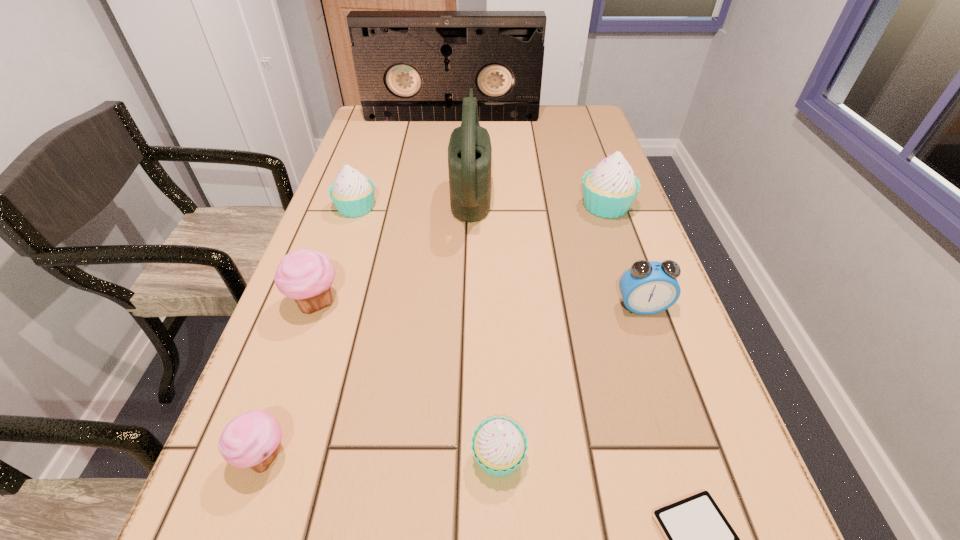
Where is `the second closest cupcake to the third farthest cupcake`? the second closest cupcake to the third farthest cupcake is located at coordinates (251, 440).

Choose which white cupcake is the nearest neighbor to the smallest white cupcake. Please provide its 2D coordinates. Your answer should be formatted as a tuple, i.e. [(x, y)], where the tuple contains the x and y coordinates of a point satisfying the conditions above.

[(609, 189)]

This screenshot has width=960, height=540. In order to click on white cupcake that stands as the second closest to the second white cupcake from right to left in this screenshot , I will do `click(352, 193)`.

Where is `vacant region that satisfies the following two spatial constraints: 1. on the front side of the smallest white cupcake; 2. on the left side of the videotape`? vacant region that satisfies the following two spatial constraints: 1. on the front side of the smallest white cupcake; 2. on the left side of the videotape is located at coordinates tap(418, 456).

Find the location of a particular element. This screenshot has width=960, height=540. free region that satisfies the following two spatial constraints: 1. on the back side of the farther pink cupcake; 2. on the left side of the second biggest white cupcake is located at coordinates (349, 207).